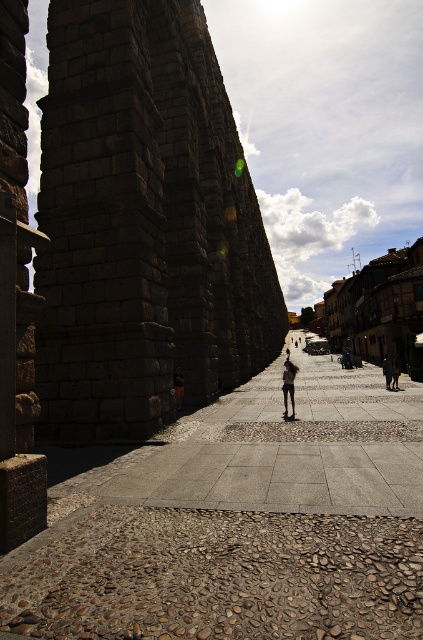
Is the position of brown stone alley at center more distant than that of dark blue jeans at center?

That is False.

Is point (302, 440) positioned behind point (285, 400)?

No, (302, 440) is in front of (285, 400).

Is point (230, 573) positioned in front of point (288, 364)?

Yes.

Find the location of a particular element. The image size is (423, 640). brown stone alley at center is located at coordinates (238, 520).